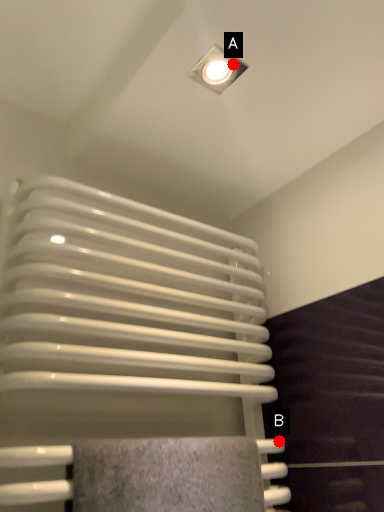
Question: Two points are circled on the image, labeled by A and B beside each circle. Which point is closer to the camera?

Choices:
 (A) A is closer
 (B) B is closer

Answer: (A)